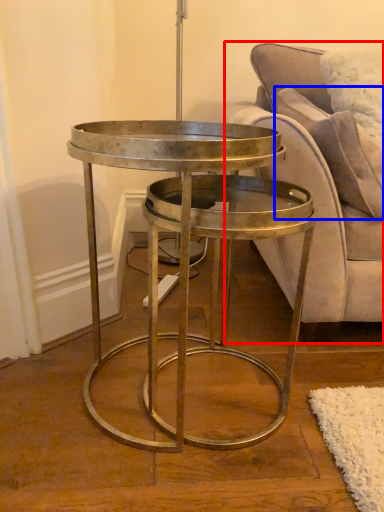
Question: Which point is further to the camera, studio couch (highlighted by a red box) or pillow (highlighted by a blue box)?

Choices:
 (A) studio couch
 (B) pillow

Answer: (B)